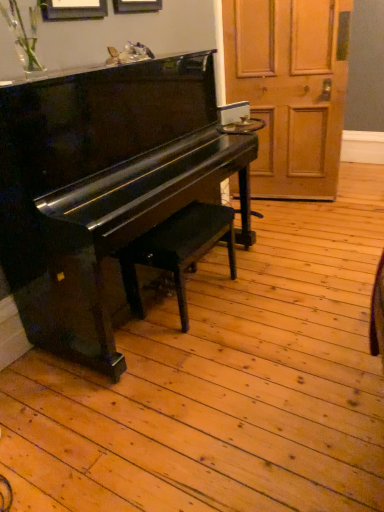
Question: Do you think glossy black piano at left is within matte black bench at center, or outside of it?

Choices:
 (A) inside
 (B) outside

Answer: (B)

Question: Looking at their shapes, would you say glossy black piano at left is wider or thinner than matte black bench at center?

Choices:
 (A) wide
 (B) thin

Answer: (A)

Question: Which of these objects is positioned closest to the matte black bench at center?

Choices:
 (A) glossy black piano at left
 (B) wooden door at right

Answer: (A)

Question: Which object is positioned closest to the wooden door at right?

Choices:
 (A) matte black bench at center
 (B) glossy black piano at left

Answer: (B)